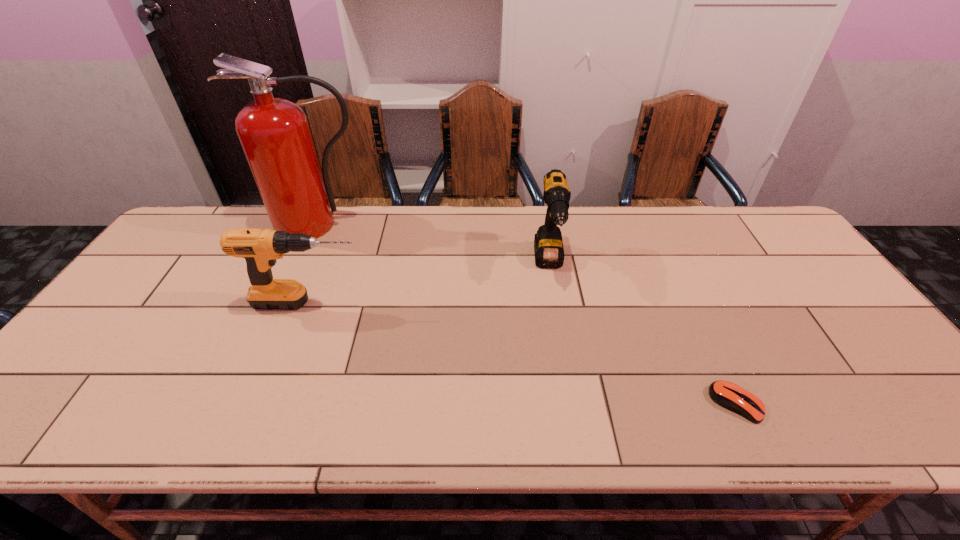
Where is `fire extinguisher`? The image size is (960, 540). fire extinguisher is located at coordinates (275, 135).

Locate an element on the screen. the farther drill is located at coordinates (548, 246).

At what (x,y) coordinates should I click in order to perform the action: click on the second object from right to left. Please return your answer as a coordinate pair (x, y). The image size is (960, 540). Looking at the image, I should click on (548, 246).

Where is `the third farthest object`? Image resolution: width=960 pixels, height=540 pixels. the third farthest object is located at coordinates (260, 248).

Locate an element on the screen. The image size is (960, 540). the left drill is located at coordinates (260, 248).

At what (x,y) coordinates should I click in order to perform the action: click on the nearest object. Please return your answer as a coordinate pair (x, y). This screenshot has width=960, height=540. Looking at the image, I should click on (728, 395).

The height and width of the screenshot is (540, 960). Find the location of `the rightmost object`. the rightmost object is located at coordinates (728, 395).

This screenshot has width=960, height=540. In order to click on free space located 0.270m with the handle and nozzle on the tallest object in this screenshot , I will do `click(282, 306)`.

Identify the location of free space located 0.070m at the tip of the farther drill. The width and height of the screenshot is (960, 540). tap(557, 308).

Find the location of `vacant point located 0.120m at the tip of the second nearest object`. vacant point located 0.120m at the tip of the second nearest object is located at coordinates (411, 303).